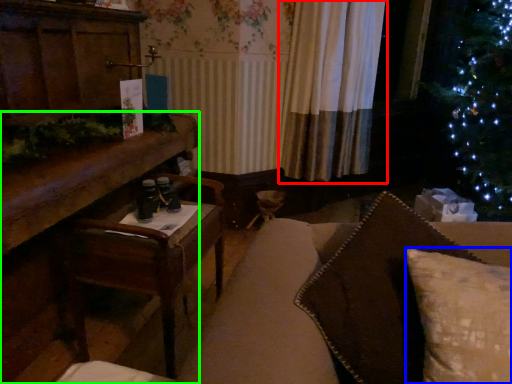
Question: Which is nearer to the curtain (highlighted by a red box)? pillow (highlighted by a blue box) or furniture (highlighted by a green box).

Choices:
 (A) pillow
 (B) furniture

Answer: (B)